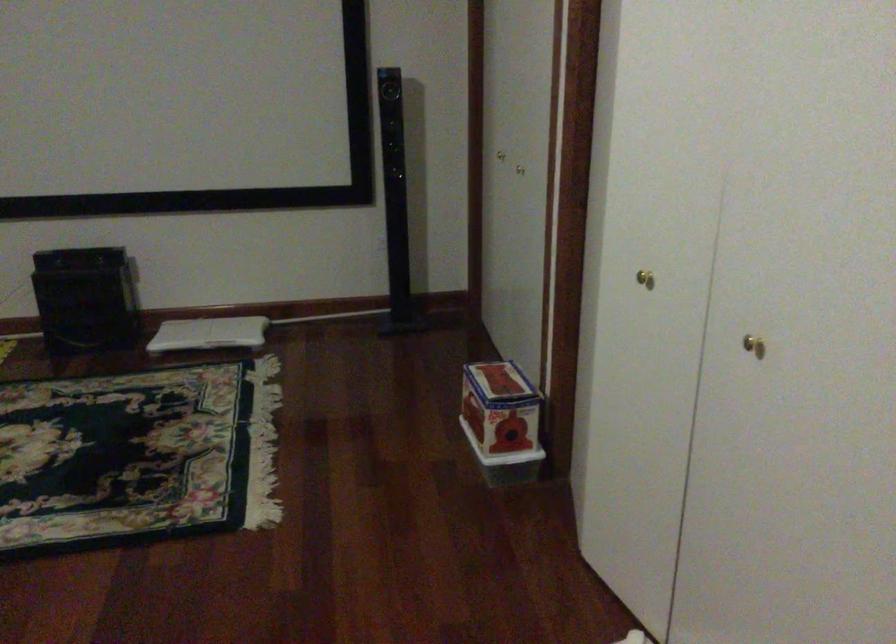
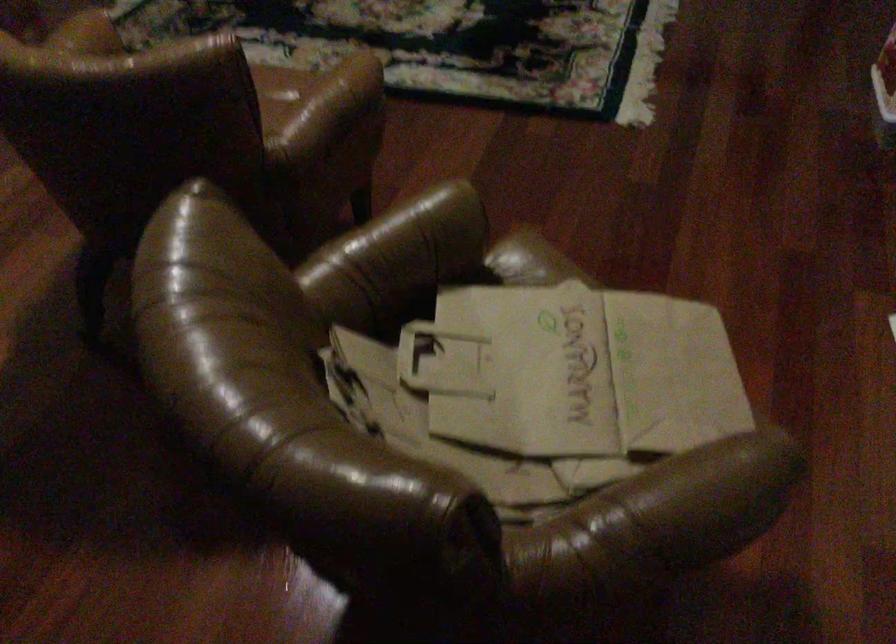
The first image is from the beginning of the video and the second image is from the end. How did the camera likely rotate when shooting the video?

The camera's rotation is toward left-down.